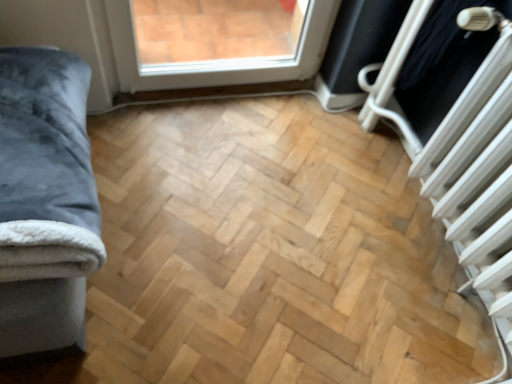
Question: Is point (387, 74) positioned closer to the camera than point (47, 296)?

Choices:
 (A) closer
 (B) farther

Answer: (B)

Question: In the image, is white metallic radiator at right positioned in front of or behind velvet grey blanket at left?

Choices:
 (A) front
 (B) behind

Answer: (B)

Question: Which object is positioned closest to the velvet grey blanket at left?

Choices:
 (A) white plastic radiator at upper right
 (B) white metallic radiator at right

Answer: (B)

Question: Estimate the real-world distances between objects in this image. Which object is closer to the velvet grey blanket at left?

Choices:
 (A) white metallic radiator at right
 (B) white plastic radiator at upper right

Answer: (A)